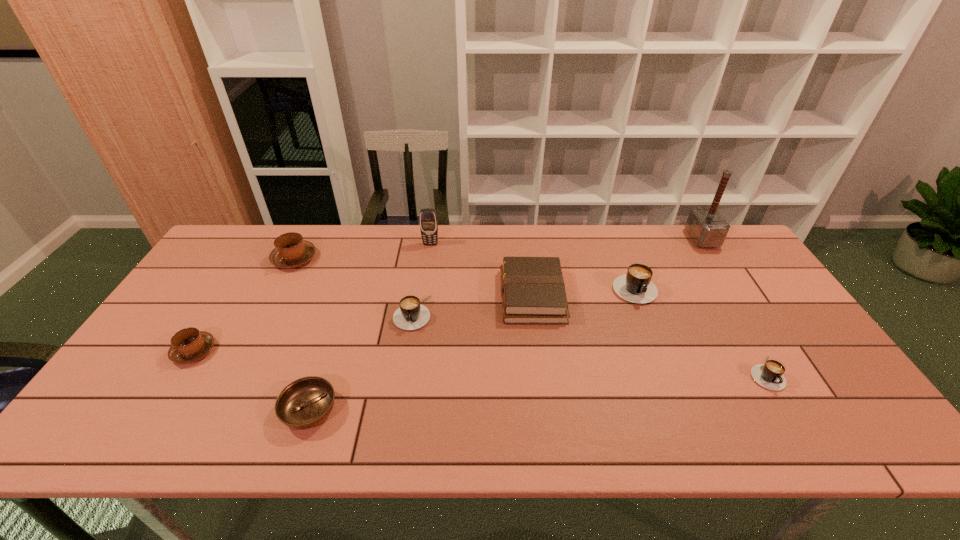
Find the location of `the smaller brown cappuccino`. the smaller brown cappuccino is located at coordinates (188, 345).

The image size is (960, 540). What are the coordinates of `the left brown cappuccino` in the screenshot? It's located at (188, 345).

Image resolution: width=960 pixels, height=540 pixels. What are the coordinates of `the nearest black cappuccino` in the screenshot? It's located at (769, 375).

Locate an element on the screen. The height and width of the screenshot is (540, 960). the shortest cappuccino is located at coordinates (769, 375).

Where is `soup bowl`? The image size is (960, 540). soup bowl is located at coordinates (306, 402).

Locate an element on the screen. This screenshot has height=540, width=960. free space located on the front of the brown hammer is located at coordinates (756, 323).

Locate an element on the screen. This screenshot has height=540, width=960. free space located 0.130m on the front face of the cellular telephone is located at coordinates (426, 271).

I want to click on free space located with the handle on the side of the seventh object from left to right, so click(664, 367).

Where is `free spot located 0.190m on the side of the eighth object from right to left with the handle`? This screenshot has width=960, height=540. free spot located 0.190m on the side of the eighth object from right to left with the handle is located at coordinates (265, 316).

Identify the location of free location located 0.120m on the spine side of the Bible. This screenshot has height=540, width=960. (461, 296).